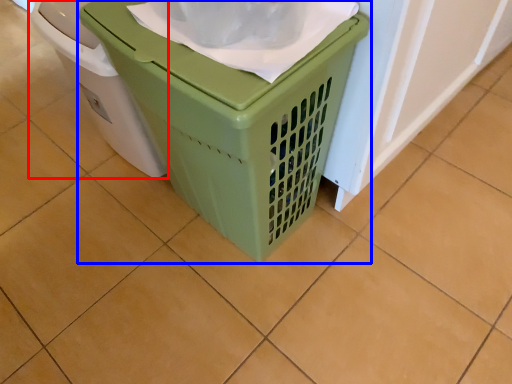
Question: Which object appears closest to the camera in this image, waste container (highlighted by a red box) or waste container (highlighted by a blue box)?

Choices:
 (A) waste container
 (B) waste container

Answer: (B)